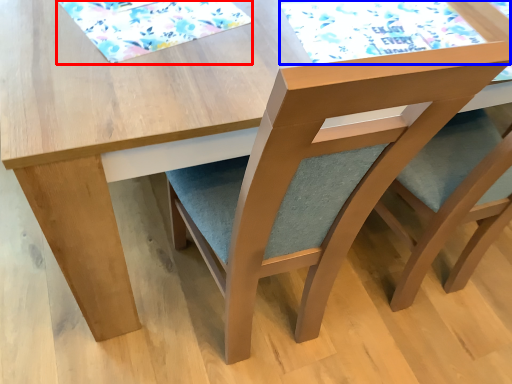
Question: Which point is further to the camera, mat (highlighted by a red box) or mat (highlighted by a blue box)?

Choices:
 (A) mat
 (B) mat

Answer: (B)